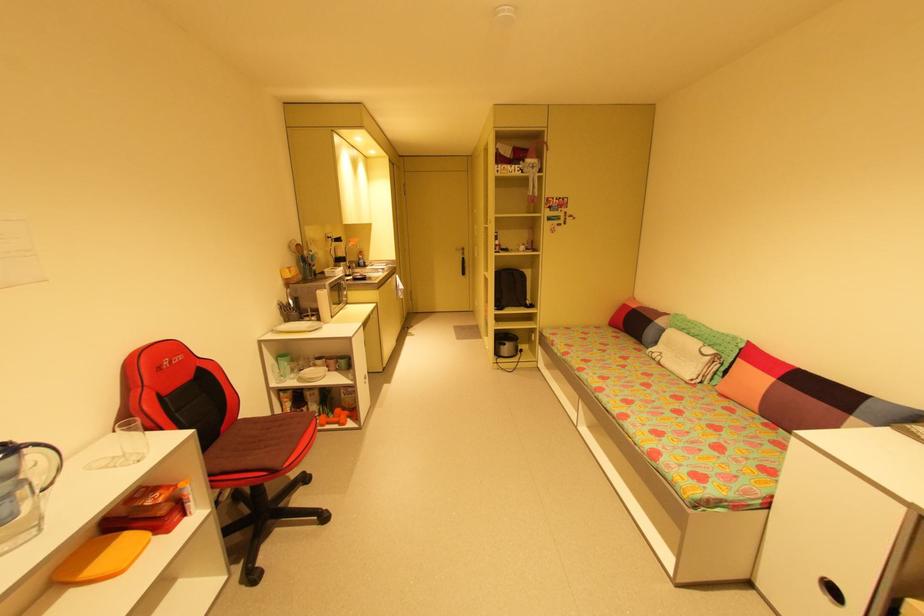
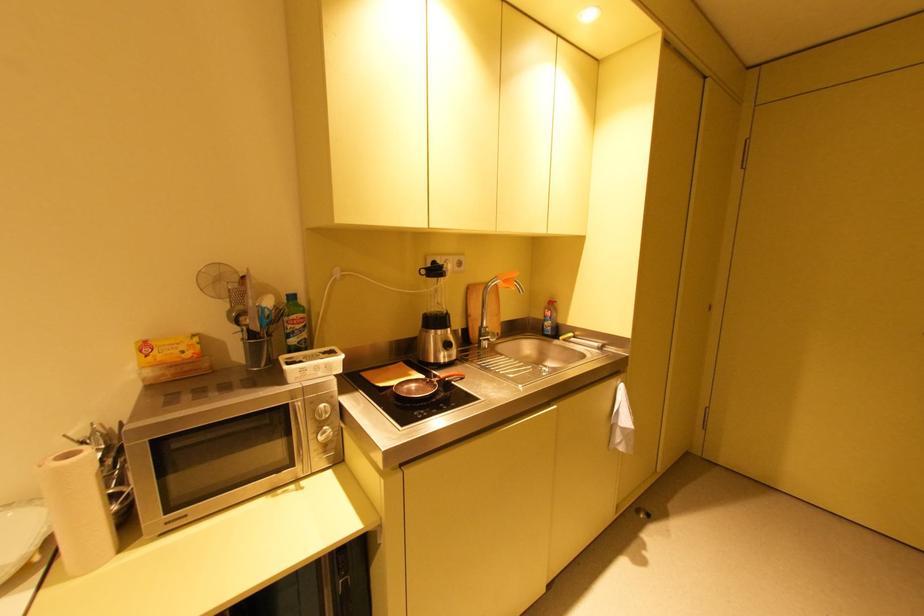
Find the pixel in the second image that matches [295,270] in the first image.

(150, 347)